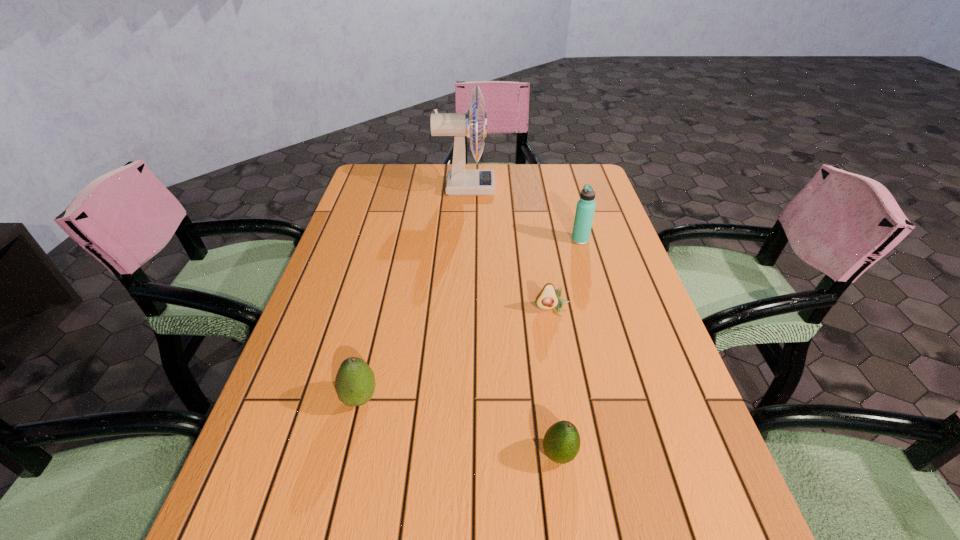
Select which object appears as the closest to the nearest avocado. Please provide its 2D coordinates. Your answer should be formatted as a tuple, i.e. [(x, y)], where the tuple contains the x and y coordinates of a point satisfying the conditions above.

[(548, 298)]

Select which object appears as the closest to the nearest object. Please provide its 2D coordinates. Your answer should be formatted as a tuple, i.e. [(x, y)], where the tuple contains the x and y coordinates of a point satisfying the conditions above.

[(548, 298)]

Identify which avocado is the third closest to the thermos bottle. Please provide its 2D coordinates. Your answer should be formatted as a tuple, i.e. [(x, y)], where the tuple contains the x and y coordinates of a point satisfying the conditions above.

[(355, 384)]

Identify which avocado is located as the nearest to the farthest avocado. Please provide its 2D coordinates. Your answer should be formatted as a tuple, i.e. [(x, y)], where the tuple contains the x and y coordinates of a point satisfying the conditions above.

[(561, 443)]

Identify the location of free location that satisfies the following two spatial constraints: 1. on the back side of the fourth nearest object; 2. on the front-facing side of the tallest object. (565, 187).

Identify the location of free space that satisfies the following two spatial constraints: 1. on the front-facing side of the fourth shortest object; 2. on the left side of the farthest object. Image resolution: width=960 pixels, height=540 pixels. (463, 240).

Locate an element on the screen. free space that satisfies the following two spatial constraints: 1. on the front-facing side of the second tallest object; 2. on the left side of the fourth object from right to left is located at coordinates (463, 240).

You are a GUI agent. You are given a task and a screenshot of the screen. Output one action in this format:
    pyautogui.click(x=<x>, y=<y>)
    Task: Click on the vacant space that satisfies the following two spatial constraints: 1. on the back side of the nearest object; 2. on the front-facing side of the tallest object
    The image size is (960, 540).
    Given the screenshot: What is the action you would take?
    pyautogui.click(x=521, y=187)

The width and height of the screenshot is (960, 540). I want to click on vacant point that satisfies the following two spatial constraints: 1. on the front-facing side of the tallest object; 2. on the left side of the nearest avocado, so click(x=452, y=454).